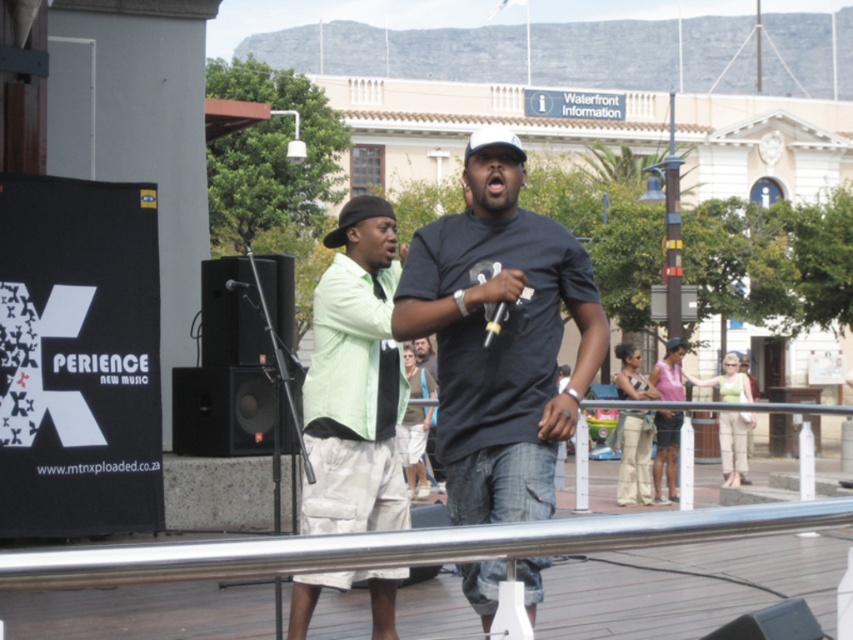
Between point (587, 374) and point (370, 195), which one is positioned in front?

Positioned in front is point (587, 374).

Image resolution: width=853 pixels, height=640 pixels. What do you see at coordinates (500, 336) in the screenshot?
I see `matte black t-shirt at center` at bounding box center [500, 336].

Who is more forward, (x=471, y=216) or (x=329, y=243)?

Point (x=471, y=216) is more forward.

Locate an element on the screen. Image resolution: width=853 pixels, height=640 pixels. matte black t-shirt at center is located at coordinates [500, 336].

Which is more to the right, light green shirt at center or polished stainless steel railing at center?

polished stainless steel railing at center is more to the right.

Is light green shirt at center shorter than polished stainless steel railing at center?

No.

The width and height of the screenshot is (853, 640). What do you see at coordinates (355, 380) in the screenshot?
I see `light green shirt at center` at bounding box center [355, 380].

Find the location of a particular element. light green shirt at center is located at coordinates (355, 380).

Looking at this image, which of these two, matte black t-shirt at center or polished stainless steel railing at center, stands shorter?

With less height is polished stainless steel railing at center.

Is matte black t-shirt at center below polished stainless steel railing at center?

No, matte black t-shirt at center is not below polished stainless steel railing at center.

The image size is (853, 640). What do you see at coordinates (500, 336) in the screenshot?
I see `matte black t-shirt at center` at bounding box center [500, 336].

The width and height of the screenshot is (853, 640). What are the coordinates of `matte black t-shirt at center` in the screenshot? It's located at (500, 336).